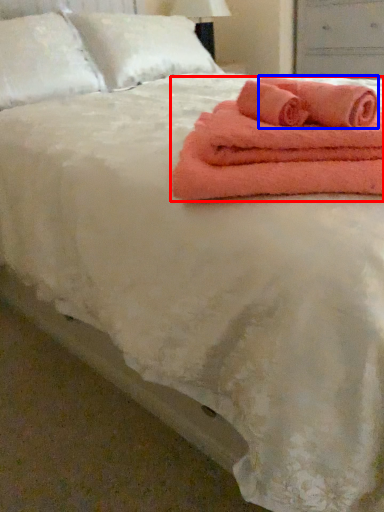
Question: Among these objects, which one is nearest to the camera, towel (highlighted by a red box) or bath towel (highlighted by a blue box)?

Choices:
 (A) towel
 (B) bath towel

Answer: (A)